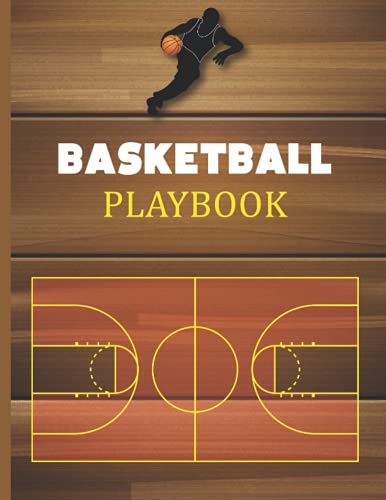
The height and width of the screenshot is (500, 386). In order to click on wood panels in this screenshot , I will do `click(246, 440)`, `click(231, 479)`, `click(334, 217)`, `click(330, 41)`.